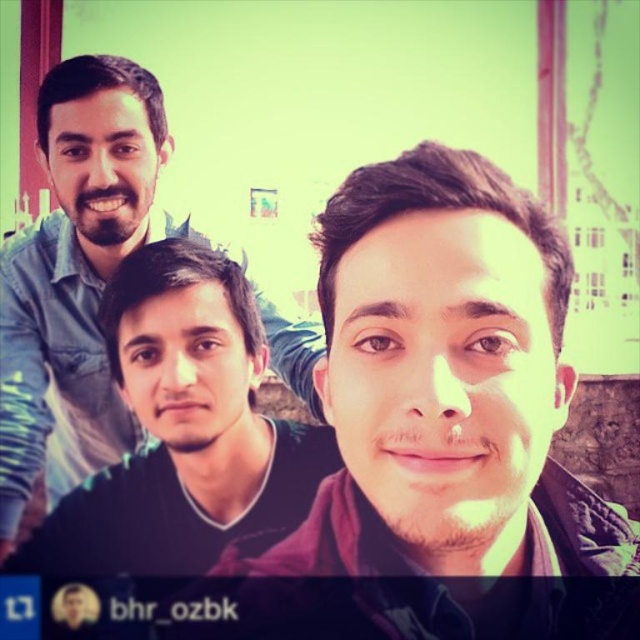
Question: Which object is closer to the camera taking this photo?

Choices:
 (A) smooth skin face at center
 (B) matte blue shirt at upper left

Answer: (A)

Question: Among these objects, which one is farthest from the camera?

Choices:
 (A) smooth skin face at center
 (B) matte blue shirt at upper left

Answer: (B)

Question: Is smooth skin face at center positioned behind matte blue shirt at upper left?

Choices:
 (A) no
 (B) yes

Answer: (A)

Question: Does smooth skin face at center have a lesser width compared to matte blue shirt at upper left?

Choices:
 (A) yes
 (B) no

Answer: (A)

Question: Can you confirm if smooth skin face at center is bigger than matte blue shirt at upper left?

Choices:
 (A) yes
 (B) no

Answer: (B)